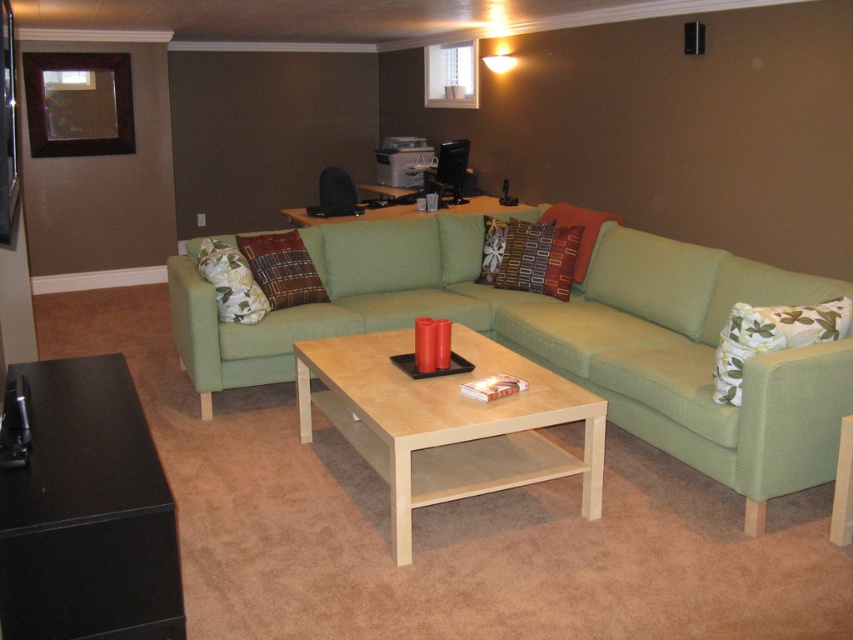
You are standing in the living space and want to place a small table between the two points, point (x=386, y=397) and point (x=548, y=224). Which point is closer to you where you should place the table first?

Point (x=386, y=397) is closer to the viewer than point (x=548, y=224), so you should place the table near point (x=386, y=397) first.